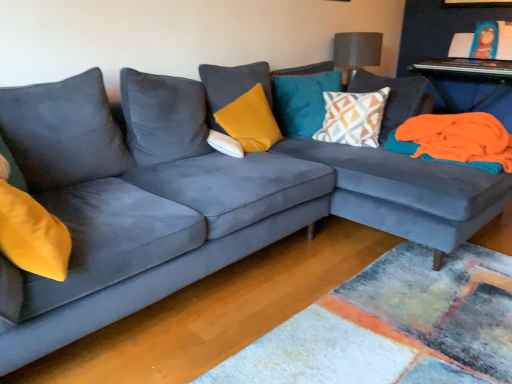
Question: Should I look upward or downward to see textured gray lampshade at upper center?

Choices:
 (A) down
 (B) up

Answer: (B)

Question: Is geometric-patterned fabric pillow at center, the fourth pillow positioned from the left, to the left of orange fleece blanket at right from the viewer's perspective?

Choices:
 (A) yes
 (B) no

Answer: (A)

Question: Does geometric-patterned fabric pillow at center, the fourth pillow positioned from the left, have a greater height compared to orange fleece blanket at right?

Choices:
 (A) no
 (B) yes

Answer: (B)

Question: Is geometric-patterned fabric pillow at center, placed as the first pillow when sorted from right to left, surrounding orange fleece blanket at right?

Choices:
 (A) no
 (B) yes

Answer: (A)

Question: Is geometric-patterned fabric pillow at center, placed as the first pillow when sorted from right to left, facing towards orange fleece blanket at right?

Choices:
 (A) no
 (B) yes

Answer: (A)

Question: Is geometric-patterned fabric pillow at center, the fourth pillow positioned from the left, facing away from orange fleece blanket at right?

Choices:
 (A) no
 (B) yes

Answer: (A)

Question: Are geometric-patterned fabric pillow at center, the fourth pillow positioned from the left, and orange fleece blanket at right making contact?

Choices:
 (A) no
 (B) yes

Answer: (A)

Question: Is yellow velvet pillow at center, positioned as the 2th pillow in left-to-right order, further to the viewer compared to orange fabric at right, positioned as the 2th table in top-to-bottom order?

Choices:
 (A) no
 (B) yes

Answer: (A)

Question: Does yellow velvet pillow at center, acting as the 3th pillow starting from the right, have a greater height compared to orange fabric at right, which appears as the first table when ordered from the bottom?

Choices:
 (A) yes
 (B) no

Answer: (A)

Question: Can you confirm if yellow velvet pillow at center, acting as the 3th pillow starting from the right, is positioned to the left of orange fabric at right, which appears as the first table when ordered from the bottom?

Choices:
 (A) yes
 (B) no

Answer: (A)

Question: From a real-world perspective, is yellow velvet pillow at center, acting as the 3th pillow starting from the right, positioned under orange fabric at right, which appears as the first table when ordered from the bottom, based on gravity?

Choices:
 (A) yes
 (B) no

Answer: (B)

Question: Does yellow velvet pillow at center, acting as the 3th pillow starting from the right, appear on the right side of orange fabric at right, positioned as the 2th table in top-to-bottom order?

Choices:
 (A) yes
 (B) no

Answer: (B)

Question: Considering the relative sizes of yellow velvet pillow at center, acting as the 3th pillow starting from the right, and orange fabric at right, positioned as the 2th table in top-to-bottom order, in the image provided, is yellow velvet pillow at center, acting as the 3th pillow starting from the right, wider than orange fabric at right, positioned as the 2th table in top-to-bottom order,?

Choices:
 (A) no
 (B) yes

Answer: (A)

Question: Is textured gray lampshade at upper center in front of teal velvet pillow at upper center, positioned as the 2th pillow in right-to-left order?

Choices:
 (A) no
 (B) yes

Answer: (A)